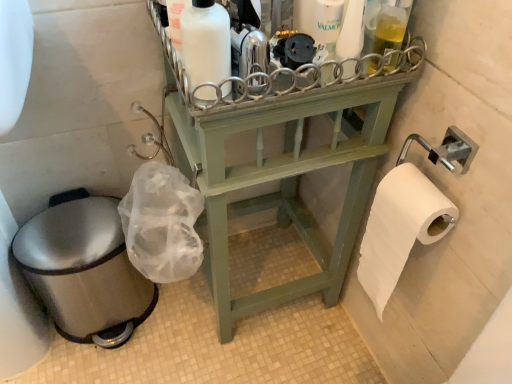
Question: From a real-world perspective, is white matte bottle at upper center physically located above or below light green wood shelf at center?

Choices:
 (A) above
 (B) below

Answer: (A)

Question: Would you say white matte bottle at upper center is to the left or to the right of light green wood shelf at center in the picture?

Choices:
 (A) right
 (B) left

Answer: (B)

Question: Estimate the real-world distances between objects in this image. Which object is farther from the brushed metal toilet bowl at lower left?

Choices:
 (A) light green wood shelf at center
 (B) white matte bottle at upper center
 (C) white plastic bottle at upper center

Answer: (C)

Question: Which is farther from the white matte bottle at upper center?

Choices:
 (A) white plastic bottle at upper center
 (B) light green wood shelf at center
 (C) brushed metal toilet bowl at lower left

Answer: (C)